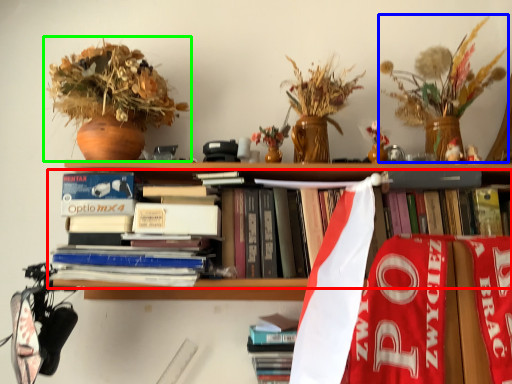
Question: Which object is the closest to the book (highlighted by a red box)? Choose among these: floral arrangement (highlighted by a blue box) or houseplant (highlighted by a green box).

Choices:
 (A) floral arrangement
 (B) houseplant

Answer: (B)